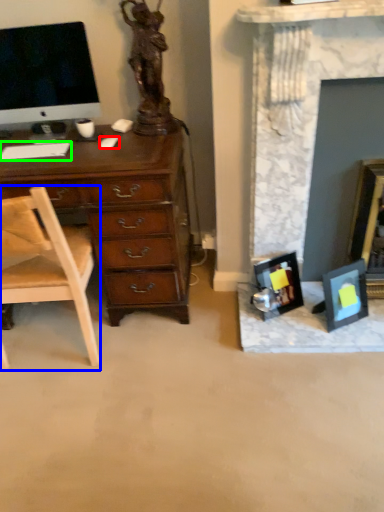
Question: Based on their relative distances, which object is nearer to computer mouse (highlighted by a red box)? Choose from chair (highlighted by a blue box) and computer keyboard (highlighted by a green box).

Choices:
 (A) chair
 (B) computer keyboard

Answer: (B)